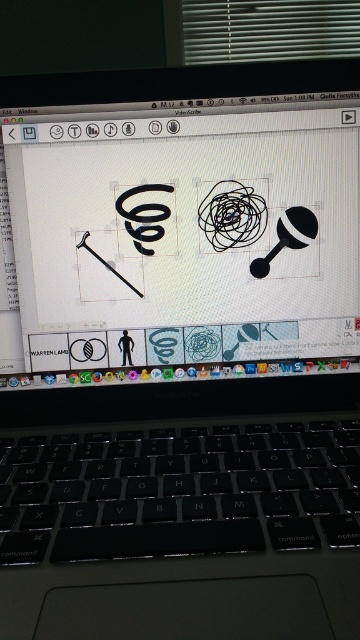
Does black matte drawing at center have a lesser width compared to black matte keyboard at lower center?

In fact, black matte drawing at center might be wider than black matte keyboard at lower center.

Based on the photo, can you confirm if black matte drawing at center is positioned below black matte keyboard at lower center?

No.

Find the location of a particular element. black matte drawing at center is located at coordinates (186, 234).